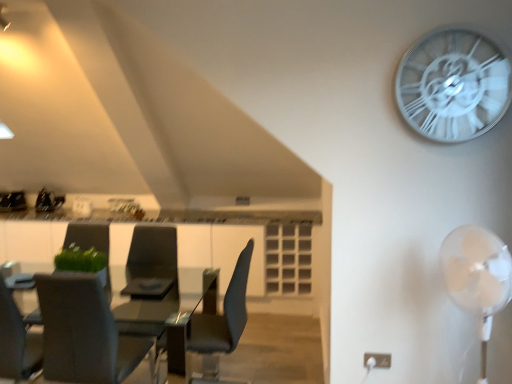
Question: Can you confirm if white plastic fan at right is positioned to the left of matte black chair at center, arranged as the first chair when viewed from the right?

Choices:
 (A) no
 (B) yes

Answer: (A)

Question: Would you say white plastic fan at right is a long distance from matte black chair at center, marked as the second chair in a left-to-right arrangement?

Choices:
 (A) yes
 (B) no

Answer: (A)

Question: Is white plastic fan at right further to the viewer compared to matte black chair at center, marked as the second chair in a left-to-right arrangement?

Choices:
 (A) yes
 (B) no

Answer: (B)

Question: Does white plastic fan at right lie in front of matte black chair at center, arranged as the first chair when viewed from the right?

Choices:
 (A) no
 (B) yes

Answer: (B)

Question: Is white plastic fan at right bigger than matte black chair at center, arranged as the first chair when viewed from the right?

Choices:
 (A) yes
 (B) no

Answer: (B)

Question: Is white plastic fan at right oriented towards matte black chair at center, arranged as the first chair when viewed from the right?

Choices:
 (A) no
 (B) yes

Answer: (B)

Question: Is matte black armchair at center, which is the 2th armchair from left to right, shorter than white metallic clock at upper right?

Choices:
 (A) no
 (B) yes

Answer: (A)

Question: Does matte black armchair at center, positioned as the first armchair in right-to-left order, have a smaller size compared to white metallic clock at upper right?

Choices:
 (A) yes
 (B) no

Answer: (B)

Question: Does matte black armchair at center, positioned as the first armchair in right-to-left order, come in front of white metallic clock at upper right?

Choices:
 (A) no
 (B) yes

Answer: (A)

Question: Are matte black armchair at center, which is the 2th armchair from left to right, and white metallic clock at upper right making contact?

Choices:
 (A) yes
 (B) no

Answer: (B)

Question: Does matte black armchair at center, positioned as the first armchair in right-to-left order, come behind white metallic clock at upper right?

Choices:
 (A) no
 (B) yes

Answer: (B)

Question: Considering the relative positions of matte black armchair at center, which is the 2th armchair from left to right, and white metallic clock at upper right in the image provided, is matte black armchair at center, which is the 2th armchair from left to right, to the left of white metallic clock at upper right from the viewer's perspective?

Choices:
 (A) yes
 (B) no

Answer: (A)

Question: Is matte black chair at center, marked as the second chair in a left-to-right arrangement, at the left side of white metallic clock at upper right?

Choices:
 (A) yes
 (B) no

Answer: (A)